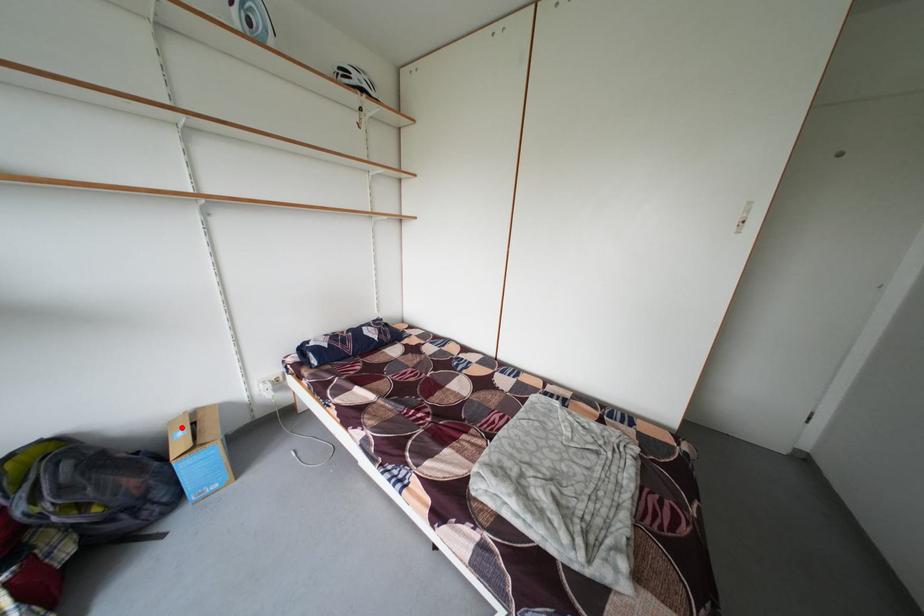
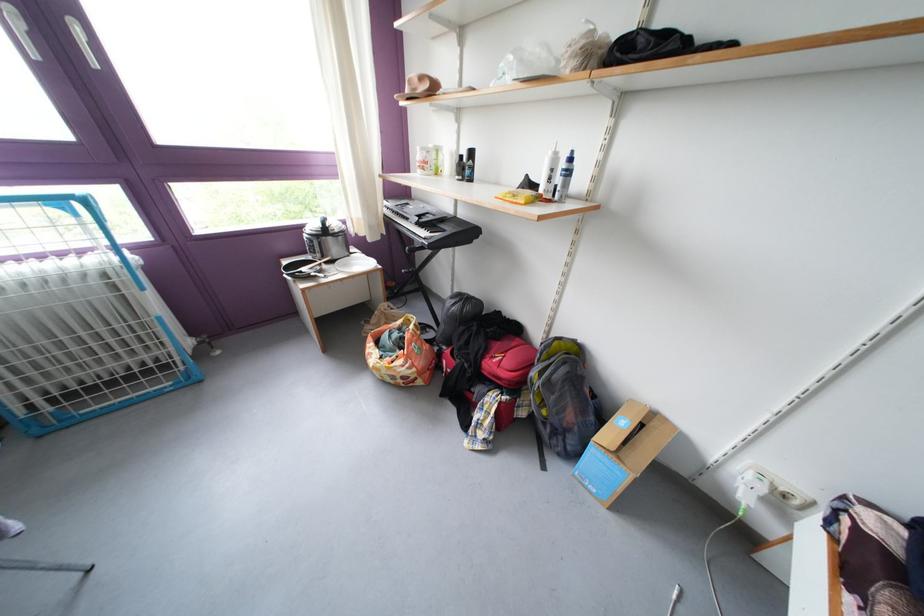
Question: I am providing you with two images of the same scene from different viewpoints. A red point is marked on the first image. Can you still see the location of the red point in image 2?

Choices:
 (A) Yes
 (B) No

Answer: (A)